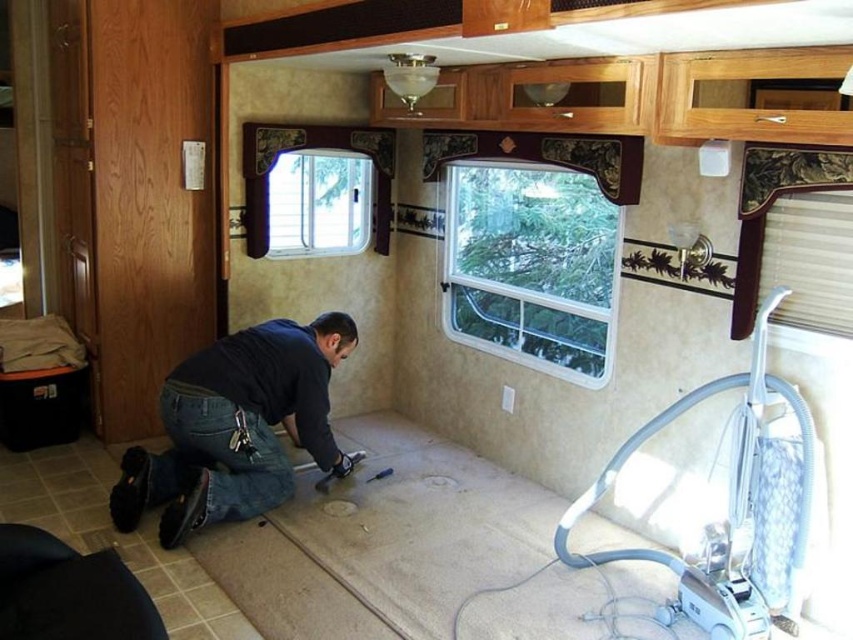
Question: Which object is positioned closest to the clear glass window at upper left?

Choices:
 (A) clear glass window at upper center
 (B) dark blue jeans at lower left

Answer: (A)

Question: Observing the image, what is the correct spatial positioning of clear glass window at upper center in reference to dark blue jeans at lower left?

Choices:
 (A) left
 (B) right

Answer: (B)

Question: Which object is closer to the camera taking this photo?

Choices:
 (A) dark blue jeans at lower left
 (B) clear glass window at upper center
 (C) clear glass window at upper left

Answer: (A)

Question: Which is nearer to the clear glass window at upper center?

Choices:
 (A) dark blue jeans at lower left
 (B) clear glass window at upper left

Answer: (B)

Question: In this image, where is dark blue jeans at lower left located relative to clear glass window at upper left?

Choices:
 (A) below
 (B) above

Answer: (A)

Question: Is clear glass window at upper center bigger than clear glass window at upper left?

Choices:
 (A) yes
 (B) no

Answer: (A)